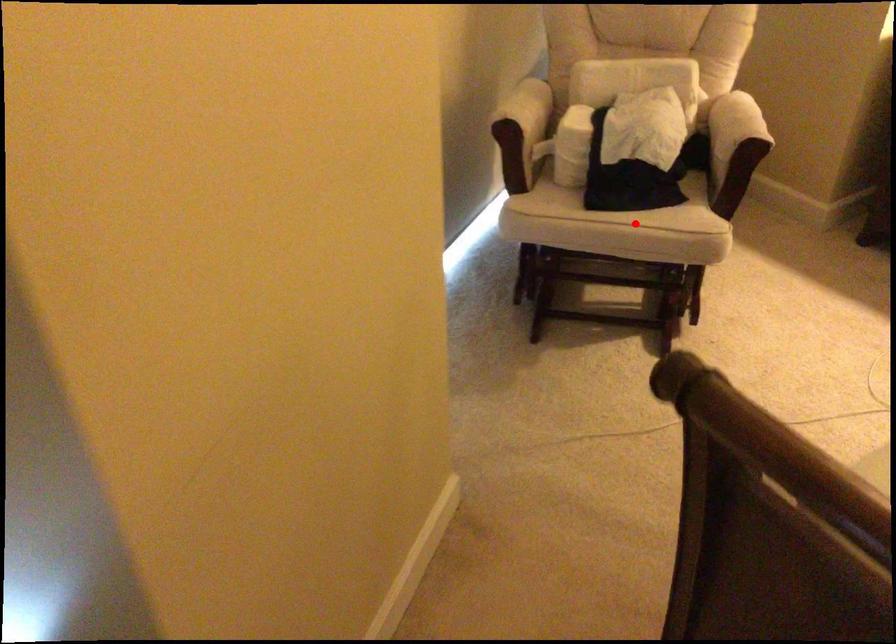
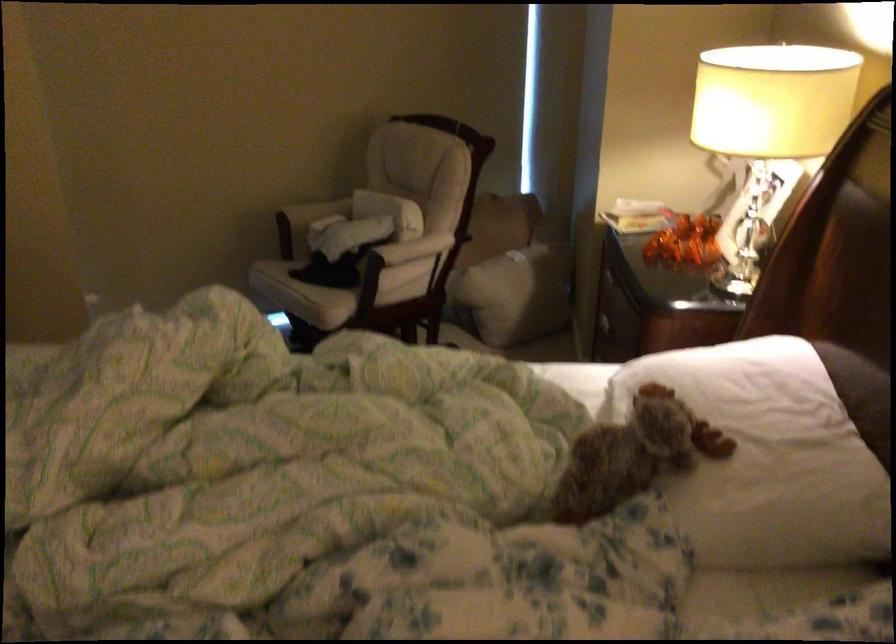
Locate, in the second image, the point that corresponds to the highlighted location in the first image.

(291, 285)